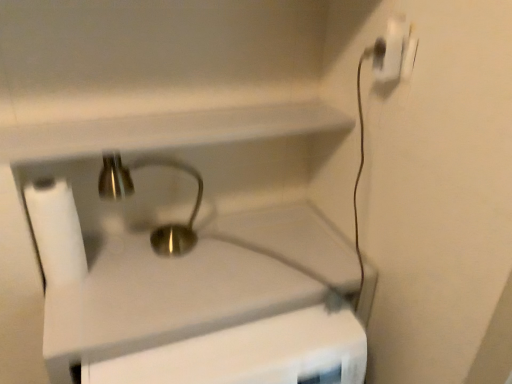
Locate an element on the screen. The image size is (512, 384). free space above brass metallic sink at center (from a real-world perspective) is located at coordinates (201, 255).